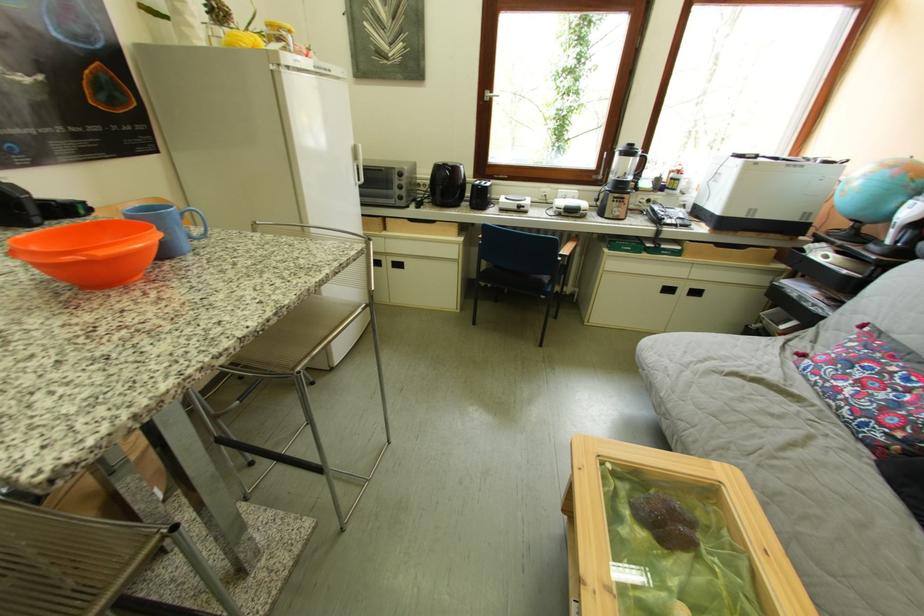
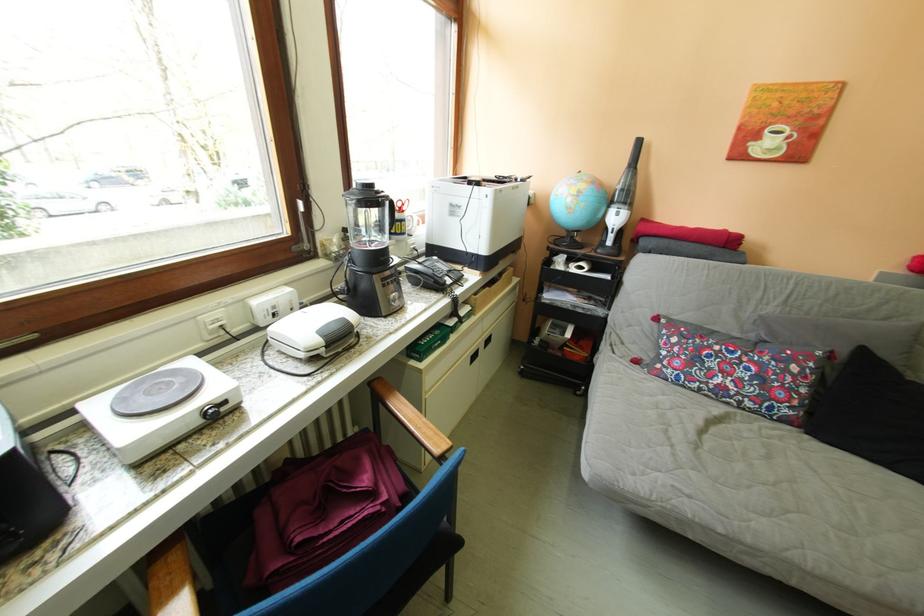
The point at [695,220] is marked in the first image. Where is the corresponding point in the second image?

(460, 272)